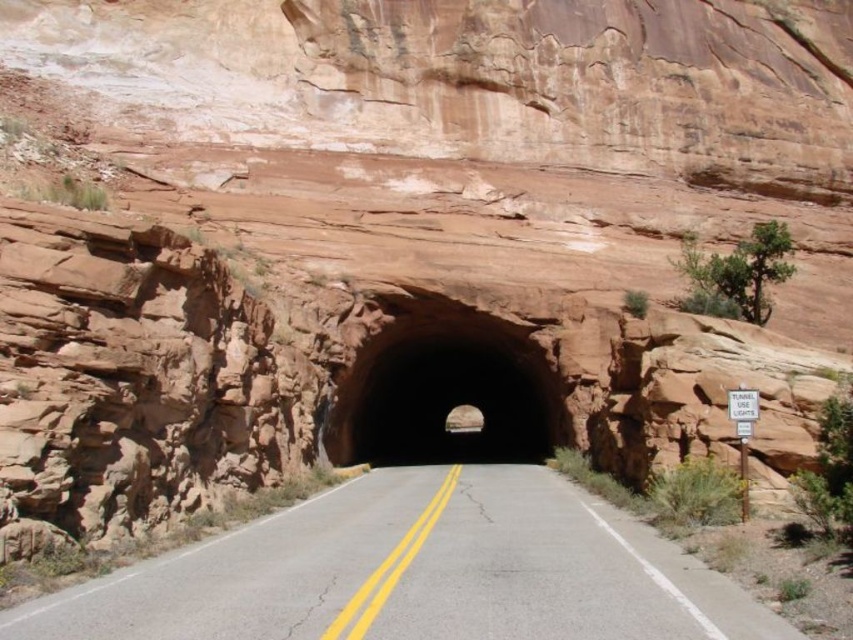
In the scene shown: You are a driver approaching the tunnel entrance. Based on the image, where is the asphalt road at center located in terms of its 2D coordinates?

The asphalt road at center is located at the 2D coordinates point (416, 572).

You are a driver approaching the tunnel entrance. You need to stay within your lane while driving through the tunnel. Given the road and tunnel sizes, will your car fit entirely within the asphalt road at center while passing through the brown rock tunnel at center?

The asphalt road at center occupies less space than the brown rock tunnel at center, so the car will fit entirely within the asphalt road at center while passing through the brown rock tunnel at center since the tunnel is wider than the road.